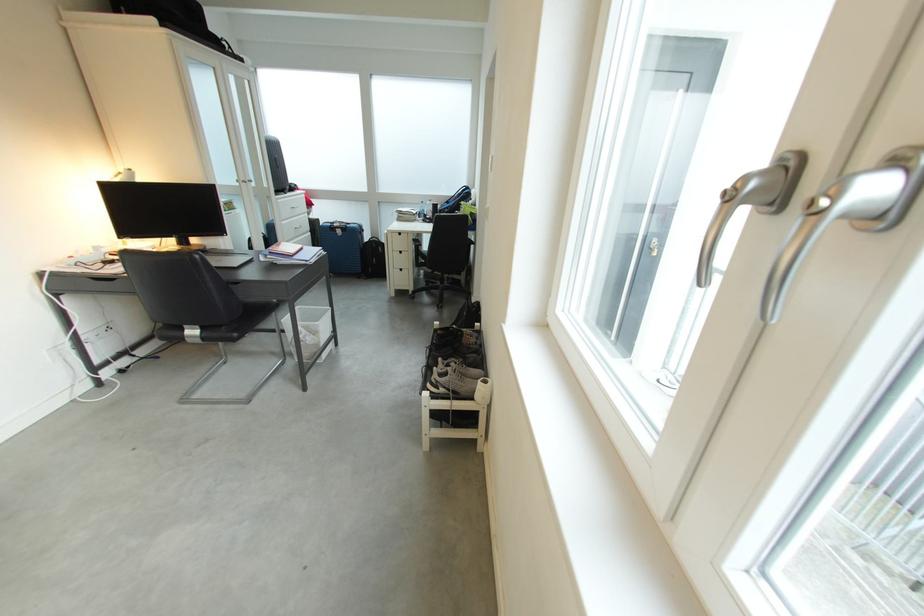
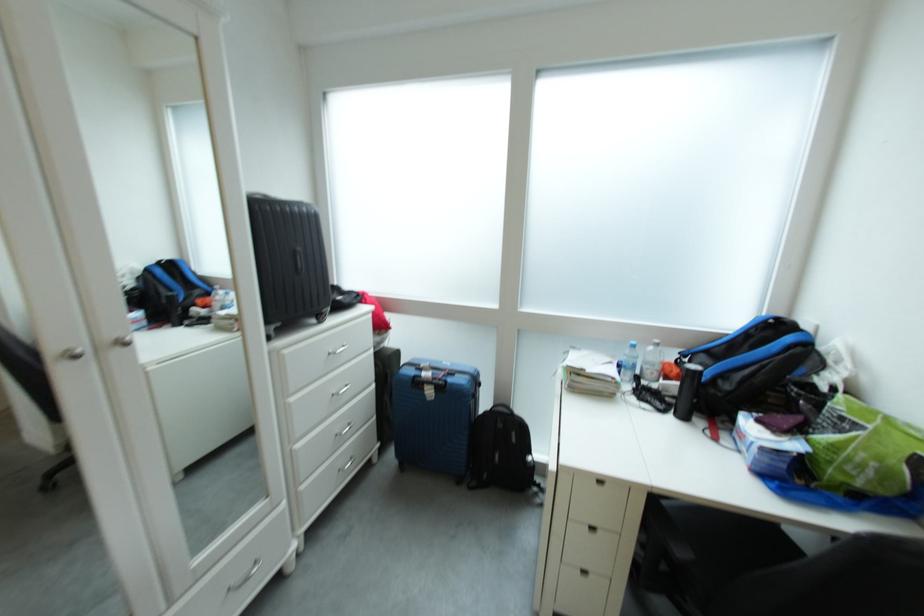
Find the pixel in the second image that matches [457,213] in the first image.

(737, 390)